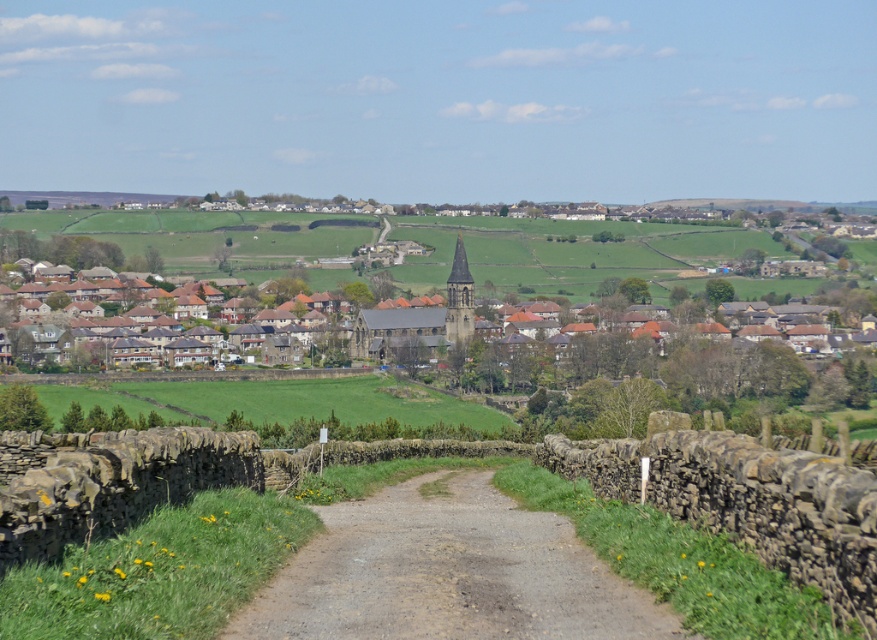
Question: Is the position of dirt road at center less distant than that of brown stone church at center?

Choices:
 (A) yes
 (B) no

Answer: (A)

Question: Can you confirm if dirt road at center is positioned below brown stone church at center?

Choices:
 (A) no
 (B) yes

Answer: (B)

Question: Does dirt road at center come in front of brown stone church at center?

Choices:
 (A) yes
 (B) no

Answer: (A)

Question: Which point appears closest to the camera in this image?

Choices:
 (A) (467, 269)
 (B) (326, 508)

Answer: (B)

Question: Which object is farther from the camera taking this photo?

Choices:
 (A) dirt road at center
 (B) brown stone church at center

Answer: (B)

Question: Among these objects, which one is nearest to the camera?

Choices:
 (A) brown stone church at center
 (B) dirt road at center

Answer: (B)